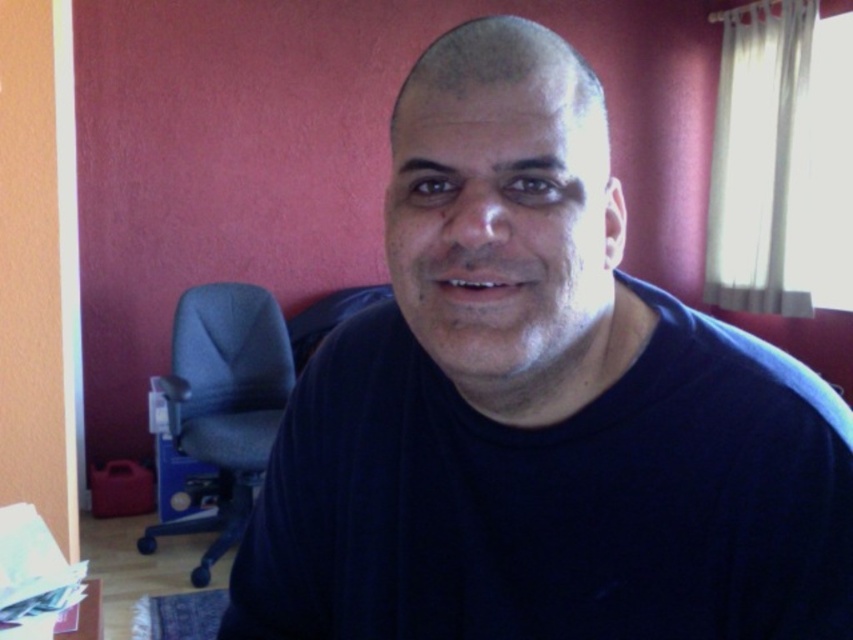
Who is shorter, dark blue t-shirt at center or wooden table at lower left?

Standing shorter between the two is wooden table at lower left.

From the picture: Does dark blue t-shirt at center lie in front of wooden table at lower left?

Yes, dark blue t-shirt at center is in front of wooden table at lower left.

Which is in front, point (428, 454) or point (55, 618)?

Point (428, 454) is in front.

At what (x,y) coordinates should I click in order to perform the action: click on dark blue t-shirt at center. Please return your answer as a coordinate pair (x, y). Looking at the image, I should click on (538, 408).

Is point (274, 428) behind point (80, 627)?

Yes.

Does point (257, 371) come farther from viewer compared to point (86, 602)?

Yes.

The width and height of the screenshot is (853, 640). In order to click on dark gray fabric chair at left in this screenshot , I will do `click(223, 404)`.

Is dark blue t-shirt at center to the left of dark gray fabric chair at left from the viewer's perspective?

Incorrect, dark blue t-shirt at center is not on the left side of dark gray fabric chair at left.

Does point (289, 554) come behind point (152, 541)?

No, (289, 554) is in front of (152, 541).

Locate an element on the screen. dark blue t-shirt at center is located at coordinates (538, 408).